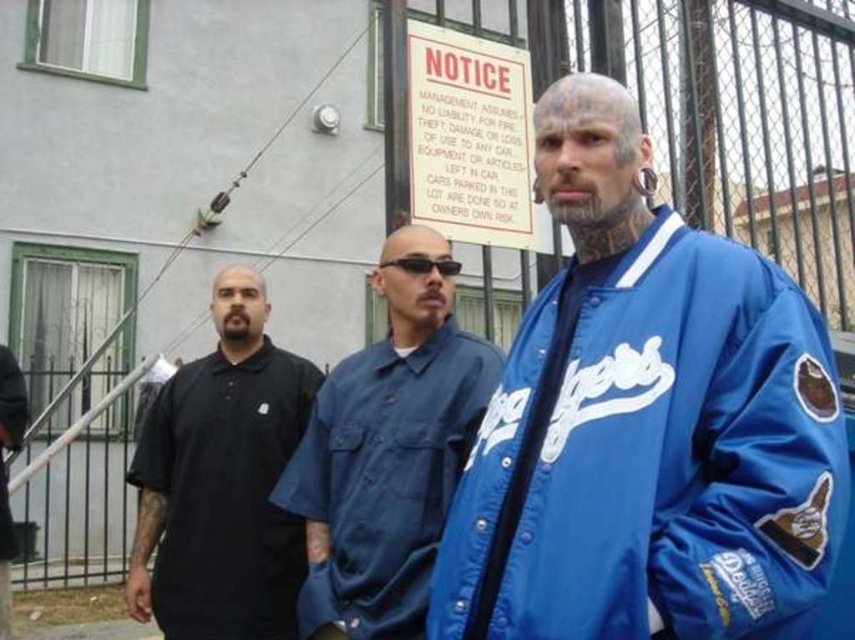
Based on the photo, who is lower down, blue satin jacket at center or black matte polo shirt at left?

black matte polo shirt at left is below.

Is blue satin jacket at center closer to camera compared to black matte polo shirt at left?

Yes, it is.

Between point (561, 378) and point (233, 403), which one is positioned in front?

Point (561, 378) is in front.

Where is `blue satin jacket at center`? The image size is (855, 640). blue satin jacket at center is located at coordinates (646, 422).

Looking at this image, does blue satin jacket at center have a smaller size compared to blue denim shirt at center?

Actually, blue satin jacket at center might be larger than blue denim shirt at center.

Is point (541, 432) more distant than point (396, 577)?

No, (541, 432) is closer to viewer.

Locate an element on the screen. blue satin jacket at center is located at coordinates (646, 422).

Can you confirm if blue denim shirt at center is positioned to the left of black matte polo shirt at left?

Incorrect, blue denim shirt at center is not on the left side of black matte polo shirt at left.

Can you confirm if blue denim shirt at center is positioned above black matte polo shirt at left?

Indeed, blue denim shirt at center is positioned over black matte polo shirt at left.

This screenshot has height=640, width=855. I want to click on blue denim shirt at center, so click(x=388, y=449).